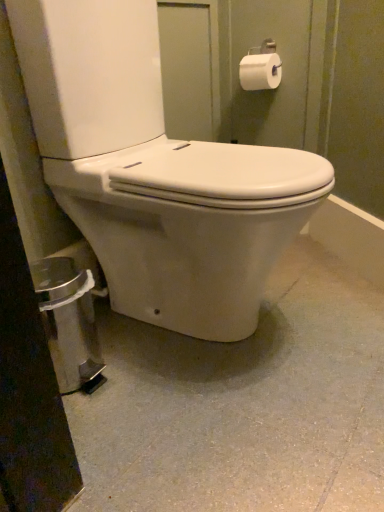
You are a GUI agent. You are given a task and a screenshot of the screen. Output one action in this format:
    pyautogui.click(x=<x>, y=<y>)
    Task: Click on the free space in front of white glossy toilet at center
    The image size is (384, 512).
    Given the screenshot: What is the action you would take?
    pyautogui.click(x=201, y=435)